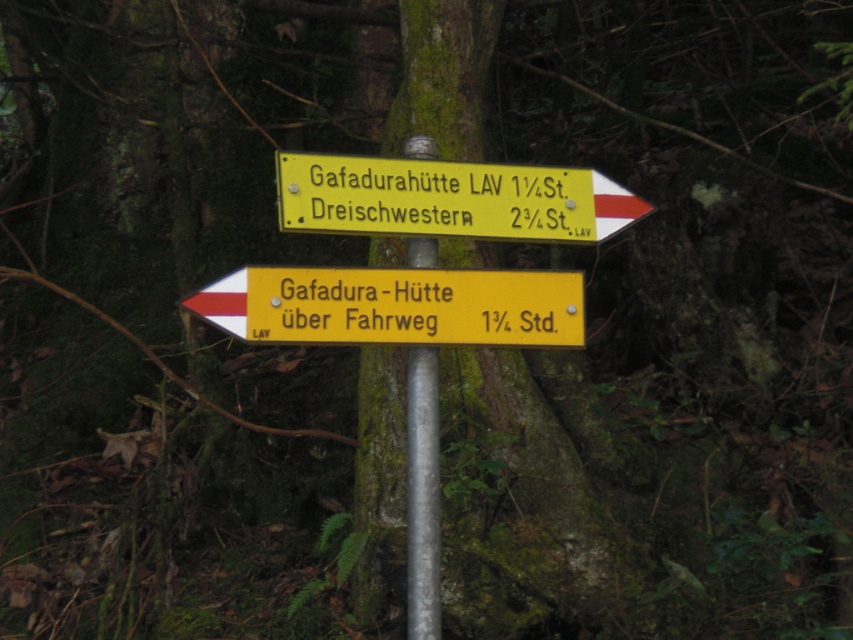
Question: Does yellow plastic sign at center have a smaller size compared to yellow plastic sign at upper center?

Choices:
 (A) yes
 (B) no

Answer: (A)

Question: Which object appears closest to the camera in this image?

Choices:
 (A) yellow plastic sign at center
 (B) yellow plastic sign at upper center

Answer: (A)

Question: Does yellow plastic sign at center have a lesser width compared to yellow plastic sign at upper center?

Choices:
 (A) yes
 (B) no

Answer: (B)

Question: Which point is farther from the camera taking this photo?

Choices:
 (A) tap(322, 304)
 (B) tap(294, 176)

Answer: (A)

Question: Does yellow plastic sign at center have a lesser width compared to yellow plastic sign at upper center?

Choices:
 (A) no
 (B) yes

Answer: (A)